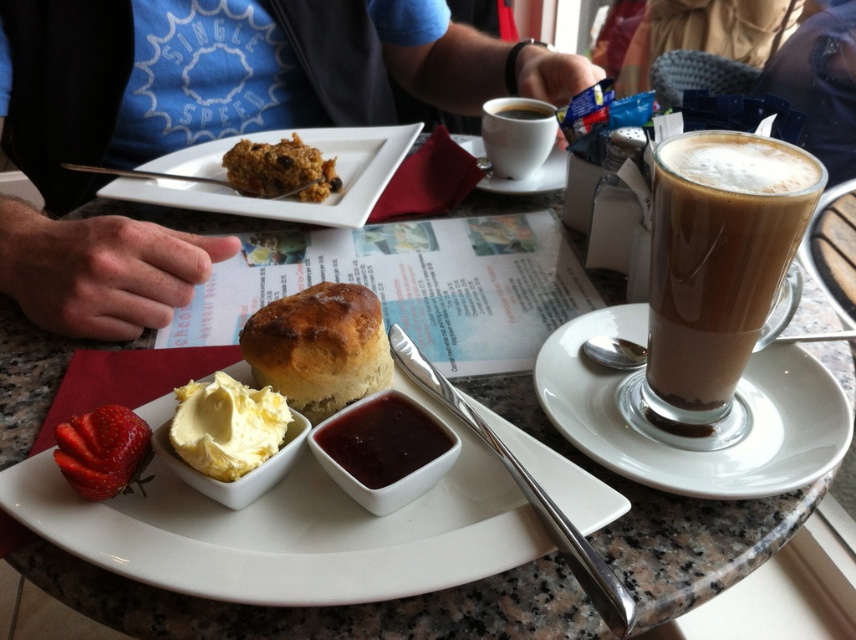
Between point (489, 115) and point (509, 112), which one is positioned behind?

The point (509, 112) is more distant.

Is point (528, 170) positioned before point (516, 116)?

That is True.

Where is `white matte cup at upper center`? The width and height of the screenshot is (856, 640). white matte cup at upper center is located at coordinates (516, 134).

Can you confirm if red matte strawberry at lower left is smaller than brown crumbly cake at center?

Correct, red matte strawberry at lower left occupies less space than brown crumbly cake at center.

Measure the distance from red matte strawberry at lower left to brown crumbly cake at center.

red matte strawberry at lower left is 11.89 inches away from brown crumbly cake at center.

Which is behind, point (92, 416) or point (263, 163)?

The point (263, 163) is behind.

Where is `red matte strawberry at lower left`? red matte strawberry at lower left is located at coordinates (103, 451).

Is white ceramic plate at upper center below white ceramic saucer at upper center?

Yes.

Is white ceramic plate at upper center further to the viewer compared to white ceramic saucer at upper center?

No, white ceramic plate at upper center is closer to the viewer.

Where is `white ceramic plate at upper center`? The width and height of the screenshot is (856, 640). white ceramic plate at upper center is located at coordinates (283, 198).

Identify the location of white ceramic plate at upper center. (283, 198).